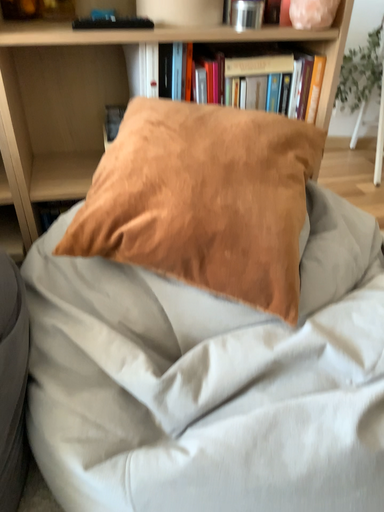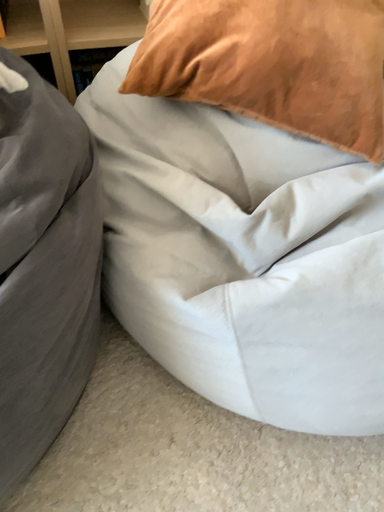
Question: How did the camera likely rotate when shooting the video?

Choices:
 (A) rotated upward
 (B) rotated downward

Answer: (B)